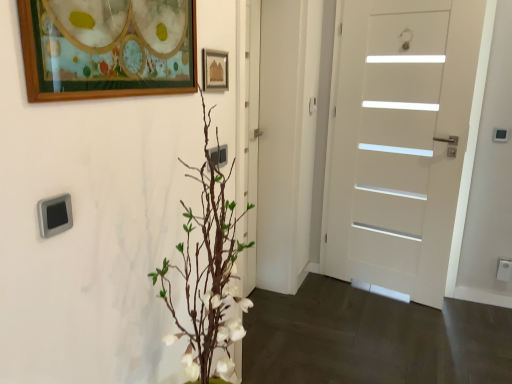
Describe the element at coordinates (55, 215) in the screenshot. Image resolution: width=512 pixels, height=384 pixels. I see `satin silver switch at upper left` at that location.

In order to click on satin silver switch at upper left in this screenshot , I will do `click(55, 215)`.

Image resolution: width=512 pixels, height=384 pixels. Describe the element at coordinates (372, 338) in the screenshot. I see `white matte vase at lower left` at that location.

In order to click on wooden picture frame at upper left, the 2th picture frame when ordered from back to front in this screenshot , I will do `click(105, 56)`.

Describe the element at coordinates (312, 105) in the screenshot. The width and height of the screenshot is (512, 384). I see `satin silver door handle at upper center` at that location.

In order to click on white matte door at right in this screenshot , I will do `click(400, 141)`.

Is wooden picture frame at upper center, which appears as the 2th picture frame when viewed from the left, completely or partially outside of white matte door at right?

Indeed, wooden picture frame at upper center, which appears as the 2th picture frame when viewed from the left, is completely outside white matte door at right.

There is a white matte door at right. At what (x,y) coordinates should I click in order to perform the action: click on the 2nd picture frame above it (from the image's perspective). Please return your answer as a coordinate pair (x, y). The height and width of the screenshot is (384, 512). Looking at the image, I should click on (215, 69).

Is wooden picture frame at upper center, acting as the first picture frame starting from the back, bigger than white matte door at right?

Incorrect, wooden picture frame at upper center, acting as the first picture frame starting from the back, is not larger than white matte door at right.

From a real-world perspective, which object rests below the other?

white plastic electric outlet at lower right, which is the first electric outlet from back to front, is physically lower.

Can you see satin silver switch at upper left touching white plastic electric outlet at lower right, which is the second electric outlet from top to bottom?

No, satin silver switch at upper left is not making contact with white plastic electric outlet at lower right, which is the second electric outlet from top to bottom.

Considering the positions of points (51, 209) and (510, 272), is point (51, 209) farther from camera compared to point (510, 272)?

No, it is not.

Is satin silver switch at upper left taller or shorter than white plastic electric outlet at lower right, the second electric outlet from the left?

In the image, satin silver switch at upper left appears to be shorter than white plastic electric outlet at lower right, the second electric outlet from the left.

Can you confirm if wooden picture frame at upper center, placed as the 2th picture frame when sorted from front to back, is shorter than white matte vase at lower left?

No.

Can we say wooden picture frame at upper center, acting as the first picture frame starting from the back, lies outside white matte vase at lower left?

Yes.

Is wooden picture frame at upper center, placed as the 2th picture frame when sorted from front to back, oriented away from white matte vase at lower left?

That's not correct — wooden picture frame at upper center, placed as the 2th picture frame when sorted from front to back, is not looking away from white matte vase at lower left.

Starting from the white matte vase at lower left, which picture frame is the 1st one to the left? Please provide its 2D coordinates.

[(215, 69)]

Which object is further away from the camera, wooden picture frame at upper center, placed as the 2th picture frame when sorted from front to back, or satin silver door handle at upper center?

Positioned behind is satin silver door handle at upper center.

Does wooden picture frame at upper center, which appears as the 2th picture frame when viewed from the left, appear on the right side of satin silver door handle at upper center?

No.

Is satin silver door handle at upper center a part of wooden picture frame at upper center, the first picture frame when ordered from right to left?

No, wooden picture frame at upper center, the first picture frame when ordered from right to left, does not contain satin silver door handle at upper center.

Is wooden picture frame at upper center, which appears as the 2th picture frame when viewed from the left, next to satin silver door handle at upper center?

No, wooden picture frame at upper center, which appears as the 2th picture frame when viewed from the left, is not beside satin silver door handle at upper center.

From a real-world perspective, who is located higher, white matte door at right or wooden picture frame at upper center, acting as the first picture frame starting from the back?

wooden picture frame at upper center, acting as the first picture frame starting from the back.

In the scene shown: Is the position of white matte door at right less distant than that of wooden picture frame at upper center, placed as the 2th picture frame when sorted from front to back?

No, it is behind wooden picture frame at upper center, placed as the 2th picture frame when sorted from front to back.

Are white matte door at right and wooden picture frame at upper center, which appears as the 2th picture frame when viewed from the left, beside each other?

white matte door at right and wooden picture frame at upper center, which appears as the 2th picture frame when viewed from the left, are clearly separated.

From the picture: Does satin silver door handle at upper center have a smaller size compared to white matte door at right?

Correct, satin silver door handle at upper center occupies less space than white matte door at right.

Considering the positions of point (311, 103) and point (357, 259), is point (311, 103) closer or farther from the camera than point (357, 259)?

Point (311, 103) appears to be closer to the viewer than point (357, 259).

From a real-world perspective, is satin silver door handle at upper center beneath white matte door at right?

Incorrect, from a real-world perspective, satin silver door handle at upper center is higher than white matte door at right.

Identify the location of door located in front of the satin silver door handle at upper center. (400, 141).

From the image's perspective, is white matte vase at lower left on wooden picture frame at upper left, the 2th picture frame when ordered from back to front?

No, from the image's perspective, white matte vase at lower left is not on top of wooden picture frame at upper left, the 2th picture frame when ordered from back to front.

Based on the photo, who is bigger, white matte vase at lower left or wooden picture frame at upper left, the 1th picture frame viewed from the left?

Bigger between the two is white matte vase at lower left.

Considering the relative sizes of white matte vase at lower left and wooden picture frame at upper left, the 2th picture frame when ordered from back to front, in the image provided, is white matte vase at lower left taller than wooden picture frame at upper left, the 2th picture frame when ordered from back to front,?

No, white matte vase at lower left is not taller than wooden picture frame at upper left, the 2th picture frame when ordered from back to front.

What's the angular difference between white matte vase at lower left and wooden picture frame at upper left, the second picture frame in the right-to-left sequence,'s facing directions?

There is a 89.9-degree angle between the facing directions of white matte vase at lower left and wooden picture frame at upper left, the second picture frame in the right-to-left sequence.

At what (x,y) coordinates should I click in order to perform the action: click on picture frame that is the 1st object located in front of the white matte door at right. Please return your answer as a coordinate pair (x, y). The height and width of the screenshot is (384, 512). Looking at the image, I should click on (215, 69).

Find the location of a particular element. electric outlet below the satin silver switch at upper left (from a real-world perspective) is located at coordinates (504, 269).

Based on their spatial positions, is satin silver switch at upper left or white matte vase at lower left closer to wooden picture frame at upper left, the 2th picture frame when ordered from back to front?

Based on the image, satin silver switch at upper left appears to be nearer to wooden picture frame at upper left, the 2th picture frame when ordered from back to front.

When comparing their distances from white matte door at right, does wooden picture frame at upper center, acting as the first picture frame starting from the back, or wooden picture frame at upper left, the second picture frame in the right-to-left sequence, seem closer?

wooden picture frame at upper center, acting as the first picture frame starting from the back.

Considering their positions, is satin silver door handle at upper center positioned closer to white matte door at right than wooden picture frame at upper left, the first picture frame in the front-to-back sequence?

satin silver door handle at upper center is positioned closer to the anchor white matte door at right.

Which object lies further to the anchor point white plastic electric outlet at lower right, the second electric outlet from the left, satin silver door handle at upper center or white matte vase at lower left?

satin silver door handle at upper center is positioned further to the anchor white plastic electric outlet at lower right, the second electric outlet from the left.

When comparing their distances from satin silver door handle at upper center, does wooden picture frame at upper center, the first picture frame when ordered from right to left, or satin silver switch at upper left seem further?

Based on the image, satin silver switch at upper left appears to be further to satin silver door handle at upper center.

Considering their positions, is satin silver switch at upper left positioned further to white plastic electric outlet at lower right, acting as the first electric outlet starting from the right, than white matte vase at lower left?

satin silver switch at upper left lies further to white plastic electric outlet at lower right, acting as the first electric outlet starting from the right, than the other object.

Considering their positions, is white matte vase at lower left positioned further to wooden picture frame at upper left, the 1th picture frame viewed from the left, than white matte door at right?

white matte door at right is positioned further to the anchor wooden picture frame at upper left, the 1th picture frame viewed from the left.

Consider the image. Looking at the image, which one is located further to satin silver outlet at center, which is the first electric outlet from top to bottom, white plastic electric outlet at lower right, which is the second electric outlet from top to bottom, or satin silver door handle at upper center?

white plastic electric outlet at lower right, which is the second electric outlet from top to bottom, lies further to satin silver outlet at center, which is the first electric outlet from top to bottom, than the other object.

This screenshot has height=384, width=512. In order to click on electric outlet located between satin silver switch at upper left and white plastic electric outlet at lower right, placed as the second electric outlet when sorted from front to back, in the left-right direction in this screenshot , I will do `click(219, 155)`.

This screenshot has width=512, height=384. What are the coordinates of `door between satin silver switch at upper left and satin silver door handle at upper center in the front-back direction` in the screenshot? It's located at (x=400, y=141).

You are a GUI agent. You are given a task and a screenshot of the screen. Output one action in this format:
    pyautogui.click(x=<x>, y=<y>)
    Task: Click on the light switch between wooden picture frame at upper left, the 2th picture frame when ordered from back to front, and wooden picture frame at upper center, acting as the first picture frame starting from the back, in the front-back direction
    The height and width of the screenshot is (384, 512).
    Given the screenshot: What is the action you would take?
    pyautogui.click(x=55, y=215)

Locate an element on the screen. The width and height of the screenshot is (512, 384). door between white matte vase at lower left and white plastic electric outlet at lower right, which is the second electric outlet from top to bottom, along the z-axis is located at coordinates coord(400,141).